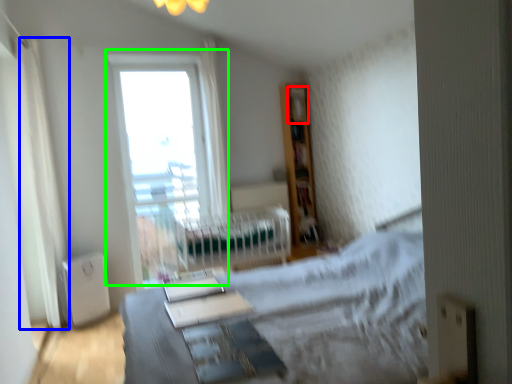
Question: Considering the real-world distances, which object is farthest from shelf (highlighted by a red box)? curtain (highlighted by a blue box) or window (highlighted by a green box)?

Choices:
 (A) curtain
 (B) window

Answer: (A)